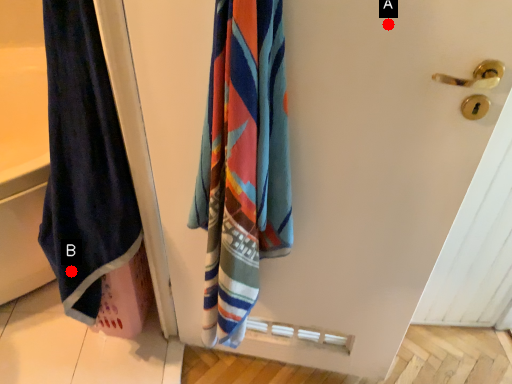
Question: Two points are circled on the image, labeled by A and B beside each circle. Which point is farther from the camera taking this photo?

Choices:
 (A) A is further
 (B) B is further

Answer: (B)